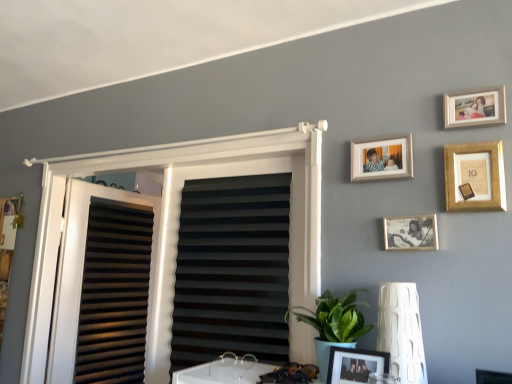
Based on the photo, measure the distance between metallic silver photo frame at center-right, which appears as the 4th picture frame when viewed from the top, and camera.

metallic silver photo frame at center-right, which appears as the 4th picture frame when viewed from the top, is 1.32 meters away from camera.

Describe the element at coordinates (114, 294) in the screenshot. The height and width of the screenshot is (384, 512). I see `white matte curtain at left` at that location.

In order to click on gold metallic photo frame at upper right, which ranks as the 5th picture frame in bottom-to-top order in this screenshot , I will do `click(475, 107)`.

Starting from the white plastic window frame at upper center, which picture frame is the 3rd one in front? Please provide its 2D coordinates.

[(475, 107)]

Considering the sizes of objects gold metallic photo frame at upper right, which ranks as the 5th picture frame in bottom-to-top order, and white plastic window frame at upper center in the image provided, who is thinner, gold metallic photo frame at upper right, which ranks as the 5th picture frame in bottom-to-top order, or white plastic window frame at upper center?

gold metallic photo frame at upper right, which ranks as the 5th picture frame in bottom-to-top order.

Measure the distance from gold metallic photo frame at upper right, which is the first picture frame from top to bottom, to white plastic window frame at upper center.

The distance of gold metallic photo frame at upper right, which is the first picture frame from top to bottom, from white plastic window frame at upper center is 1.03 meters.

Is gold metallic photo frame at upper right, which ranks as the 5th picture frame in bottom-to-top order, facing away from white plastic window frame at upper center?

gold metallic photo frame at upper right, which ranks as the 5th picture frame in bottom-to-top order, does not have its back to white plastic window frame at upper center.

Is metallic silver photo frame at center-right, the second picture frame ordered from the bottom, far away from wooden photo frame at upper right, marked as the 4th picture frame in a bottom-to-top arrangement?

No, metallic silver photo frame at center-right, the second picture frame ordered from the bottom, is not far away from wooden photo frame at upper right, marked as the 4th picture frame in a bottom-to-top arrangement.

Is the position of metallic silver photo frame at center-right, which appears as the 4th picture frame when viewed from the top, more distant than that of wooden photo frame at upper right, marked as the 4th picture frame in a bottom-to-top arrangement?

No, metallic silver photo frame at center-right, which appears as the 4th picture frame when viewed from the top, is closer to the viewer.

From a real-world perspective, who is located higher, metallic silver photo frame at center-right, which appears as the 4th picture frame when viewed from the top, or wooden photo frame at upper right, the second picture frame positioned from the top?

In real-world perspective, wooden photo frame at upper right, the second picture frame positioned from the top, is above.

Considering the positions of objects matte black picture frame at lower center, the first picture frame when ordered from bottom to top, and black matte window blind at center in the image provided, who is in front, matte black picture frame at lower center, the first picture frame when ordered from bottom to top, or black matte window blind at center?

matte black picture frame at lower center, the first picture frame when ordered from bottom to top, is closer to the camera.

Measure the distance from matte black picture frame at lower center, the fifth picture frame positioned from the top, to black matte window blind at center.

23.28 inches.

Is matte black picture frame at lower center, the fifth picture frame positioned from the top, outside of black matte window blind at center?

Yes, matte black picture frame at lower center, the fifth picture frame positioned from the top, is outside of black matte window blind at center.

From the image's perspective, does matte black picture frame at lower center, the first picture frame when ordered from bottom to top, appear lower than black matte window blind at center?

Yes, from the image's perspective, matte black picture frame at lower center, the first picture frame when ordered from bottom to top, is beneath black matte window blind at center.

Between point (463, 157) and point (123, 240), which one is positioned behind?

Point (123, 240)

Which of these two, gold metallic picture frame at upper right, the third picture frame from the top, or white matte curtain at left, is bigger?

white matte curtain at left is bigger.

Considering the positions of objects gold metallic picture frame at upper right, the third picture frame from the top, and white matte curtain at left in the image provided, who is in front, gold metallic picture frame at upper right, the third picture frame from the top, or white matte curtain at left?

gold metallic picture frame at upper right, the third picture frame from the top.

Is gold metallic picture frame at upper right, the third picture frame from the top, not inside white matte curtain at left?

That's correct, gold metallic picture frame at upper right, the third picture frame from the top, is outside of white matte curtain at left.

From the picture: Does metallic silver photo frame at center-right, the second picture frame ordered from the bottom, lie behind white matte curtain at left?

No, the depth of metallic silver photo frame at center-right, the second picture frame ordered from the bottom, is less than that of white matte curtain at left.

Is metallic silver photo frame at center-right, which appears as the 4th picture frame when viewed from the top, shorter than white matte curtain at left?

Indeed, metallic silver photo frame at center-right, which appears as the 4th picture frame when viewed from the top, has a lesser height compared to white matte curtain at left.

Which point is more distant from viewer, (428, 224) or (95, 382)?

The point (95, 382) is farther.

Locate an element on the screen. This screenshot has height=384, width=512. curtain below the metallic silver photo frame at center-right, which appears as the 4th picture frame when viewed from the top (from a real-world perspective) is located at coordinates (114, 294).

What's the angular difference between wooden photo frame at upper right, marked as the 4th picture frame in a bottom-to-top arrangement, and white matte curtain at left's facing directions?

There is a 10.3-degree angle between the facing directions of wooden photo frame at upper right, marked as the 4th picture frame in a bottom-to-top arrangement, and white matte curtain at left.

Which is closer, (375, 173) or (118, 235)?

Point (375, 173).

From a real-world perspective, who is located lower, wooden photo frame at upper right, marked as the 4th picture frame in a bottom-to-top arrangement, or white matte curtain at left?

white matte curtain at left, from a real-world perspective.

From the image's perspective, is white plastic window frame at upper center above or below gold metallic picture frame at upper right, the third picture frame from the top?

From the image's perspective, white plastic window frame at upper center appears below gold metallic picture frame at upper right, the third picture frame from the top.

Which is less distant, [38,362] or [453,159]?

Point [38,362].

From a real-world perspective, is white plastic window frame at upper center on top of gold metallic picture frame at upper right, the third picture frame from the top?

Incorrect, from a real-world perspective, white plastic window frame at upper center is lower than gold metallic picture frame at upper right, the third picture frame from the top.

Is white plastic window frame at upper center outside of gold metallic picture frame at upper right, the third picture frame from the top?

Yes.

You are a GUI agent. You are given a task and a screenshot of the screen. Output one action in this format:
    pyautogui.click(x=<x>, y=<y>)
    Task: Click on the window frame below the gold metallic photo frame at upper right, which ranks as the 5th picture frame in bottom-to-top order (from the image's perspective)
    The image size is (512, 384).
    Given the screenshot: What is the action you would take?
    click(176, 226)

Find the location of a particular element. The image size is (512, 384). the 2nd picture frame above the metallic silver photo frame at center-right, which appears as the 4th picture frame when viewed from the top (from the image's perspective) is located at coordinates (382, 158).

Looking at the image, which one is located further to metallic silver photo frame at center-right, which appears as the 4th picture frame when viewed from the top, gold metallic picture frame at upper right, arranged as the third picture frame when ordered from the bottom, or white textured lamp at lower right?

white textured lamp at lower right is further to metallic silver photo frame at center-right, which appears as the 4th picture frame when viewed from the top.

Consider the image. Which object lies nearer to the anchor point white matte curtain at left, white textured lamp at lower right or metallic silver photo frame at center-right, which appears as the 4th picture frame when viewed from the top?

Based on the image, metallic silver photo frame at center-right, which appears as the 4th picture frame when viewed from the top, appears to be nearer to white matte curtain at left.

From the image, which object appears to be nearer to wooden photo frame at upper right, marked as the 4th picture frame in a bottom-to-top arrangement, gold metallic photo frame at upper right, which ranks as the 5th picture frame in bottom-to-top order, or white matte curtain at left?

gold metallic photo frame at upper right, which ranks as the 5th picture frame in bottom-to-top order, lies closer to wooden photo frame at upper right, marked as the 4th picture frame in a bottom-to-top arrangement, than the other object.

Considering their positions, is white matte curtain at left positioned closer to black matte window blind at center than wooden photo frame at upper right, marked as the 4th picture frame in a bottom-to-top arrangement?

Based on the image, wooden photo frame at upper right, marked as the 4th picture frame in a bottom-to-top arrangement, appears to be nearer to black matte window blind at center.

From the image, which object appears to be farther from black matte window blind at center, white matte curtain at left or green leafy plant at lower center?

white matte curtain at left is positioned further to the anchor black matte window blind at center.

When comparing their distances from green leafy plant at lower center, does matte black picture frame at lower center, the fifth picture frame positioned from the top, or gold metallic picture frame at upper right, the third picture frame from the top, seem closer?

The object closer to green leafy plant at lower center is matte black picture frame at lower center, the fifth picture frame positioned from the top.

Considering their positions, is metallic silver photo frame at center-right, which appears as the 4th picture frame when viewed from the top, positioned further to wooden photo frame at upper right, marked as the 4th picture frame in a bottom-to-top arrangement, than green leafy plant at lower center?

Based on the image, green leafy plant at lower center appears to be further to wooden photo frame at upper right, marked as the 4th picture frame in a bottom-to-top arrangement.

Based on their spatial positions, is metallic silver photo frame at center-right, which appears as the 4th picture frame when viewed from the top, or black matte window blind at center closer to matte black picture frame at lower center, the fifth picture frame positioned from the top?

Among the two, metallic silver photo frame at center-right, which appears as the 4th picture frame when viewed from the top, is located nearer to matte black picture frame at lower center, the fifth picture frame positioned from the top.

Where is `houseplant between white plastic window frame at upper center and wooden photo frame at upper right, the second picture frame positioned from the top, in the horizontal direction`? houseplant between white plastic window frame at upper center and wooden photo frame at upper right, the second picture frame positioned from the top, in the horizontal direction is located at coordinates (334, 324).

This screenshot has width=512, height=384. I want to click on window blind between white plastic window frame at upper center and metallic silver photo frame at center-right, which appears as the 4th picture frame when viewed from the top, in the horizontal direction, so click(x=232, y=270).

The image size is (512, 384). I want to click on lamp situated between black matte window blind at center and gold metallic photo frame at upper right, which ranks as the 5th picture frame in bottom-to-top order, from left to right, so click(401, 331).

The width and height of the screenshot is (512, 384). What are the coordinates of `houseplant situated between white plastic window frame at upper center and gold metallic picture frame at upper right, the third picture frame from the top, from left to right` in the screenshot? It's located at (334, 324).